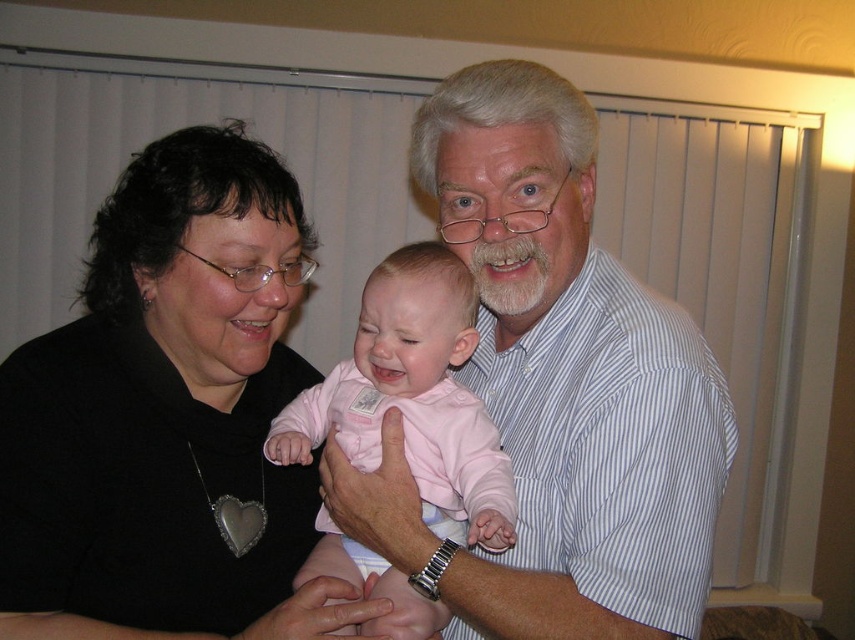
Question: Does white striped shirt at center appear under white striped shirt at upper right?

Choices:
 (A) no
 (B) yes

Answer: (A)

Question: Which object is positioned closest to the white striped shirt at upper right?

Choices:
 (A) black fabric at center
 (B) white striped shirt at center
 (C) pink fabric baby at center

Answer: (B)

Question: Is white striped shirt at center above white striped shirt at upper right?

Choices:
 (A) no
 (B) yes

Answer: (B)

Question: Among these points, which one is farthest from the camera?

Choices:
 (A) (16, 570)
 (B) (551, 630)
 (C) (555, 317)
 (D) (384, 301)

Answer: (C)

Question: Observing the image, what is the correct spatial positioning of black fabric at center in reference to pink fabric baby at center?

Choices:
 (A) left
 (B) right

Answer: (A)

Question: Among these objects, which one is farthest from the camera?

Choices:
 (A) black fabric at center
 (B) white striped shirt at upper right
 (C) pink fabric baby at center

Answer: (A)